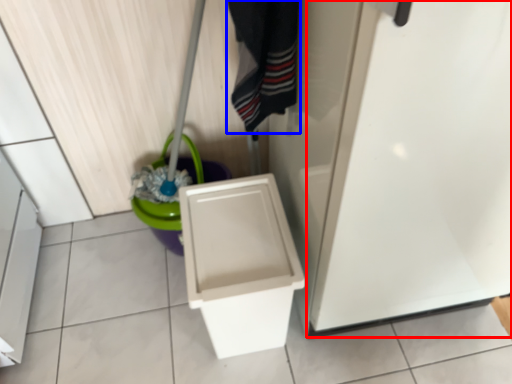
Question: Which point is closer to the camera, screen door (highlighted by a red box) or clothing (highlighted by a blue box)?

Choices:
 (A) screen door
 (B) clothing

Answer: (A)